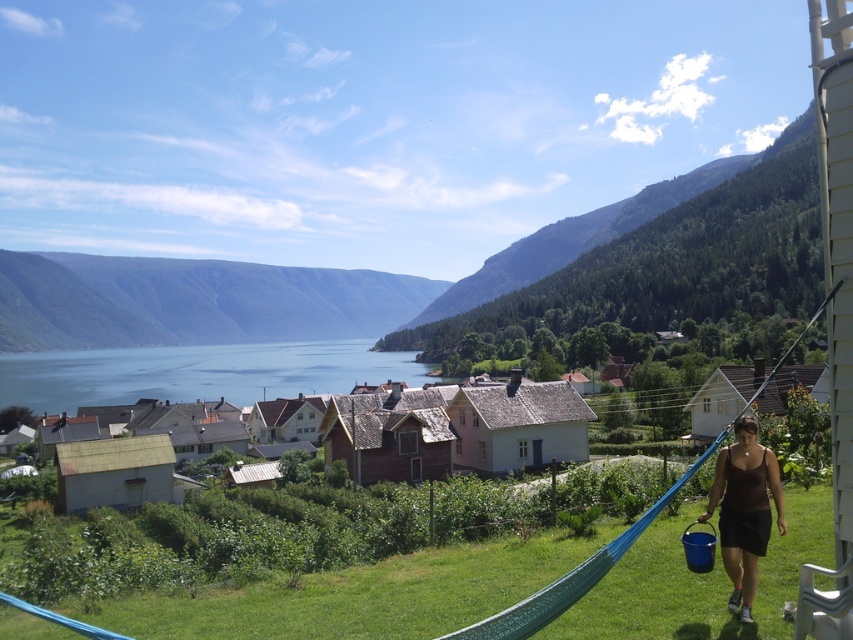
Who is lower down, green grassy mountain at left or brown fabric dress at lower right?

Positioned lower is brown fabric dress at lower right.

Consider the image. Is green grassy mountain at left bigger than brown fabric dress at lower right?

Yes, green grassy mountain at left is bigger than brown fabric dress at lower right.

Does point (344, 284) lie in front of point (737, 554)?

No, it is not.

Locate an element on the screen. This screenshot has height=640, width=853. green grassy mountain at left is located at coordinates (192, 301).

This screenshot has width=853, height=640. Identify the location of green forested mountain at upper center. (296, 282).

Can you confirm if green forested mountain at upper center is bigger than blue water at center?

Correct, green forested mountain at upper center is larger in size than blue water at center.

Is point (113, 340) positioned in front of point (73, 360)?

No, (113, 340) is further to viewer.

Where is `green forested mountain at upper center`? green forested mountain at upper center is located at coordinates (296, 282).

Can you confirm if blue water at center is positioned to the right of brown fabric dress at lower right?

No, blue water at center is not to the right of brown fabric dress at lower right.

Is blue water at center positioned before brown fabric dress at lower right?

No, blue water at center is further to the viewer.

Which is behind, point (149, 387) or point (743, 611)?

Point (149, 387)

Find the location of a particular element. blue water at center is located at coordinates tap(196, 372).